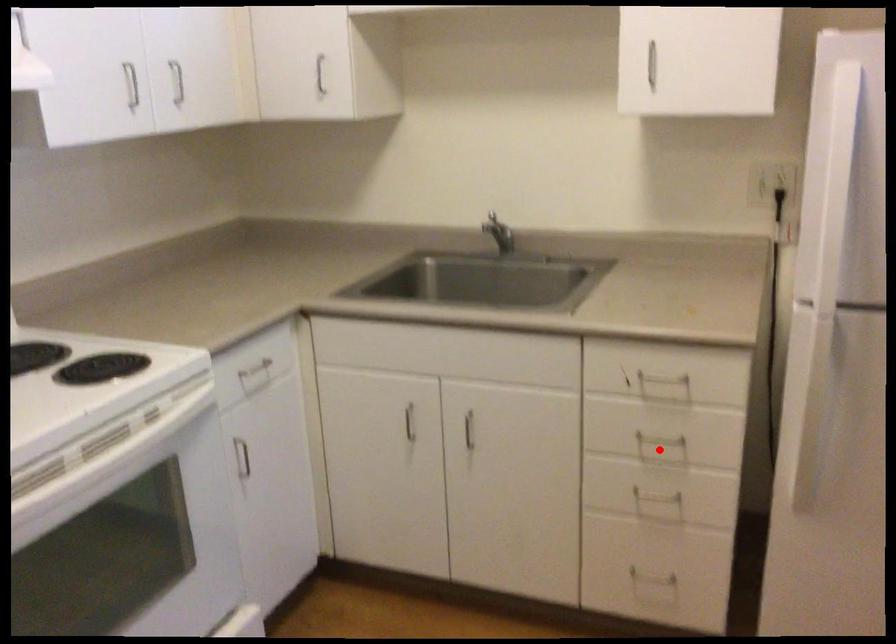
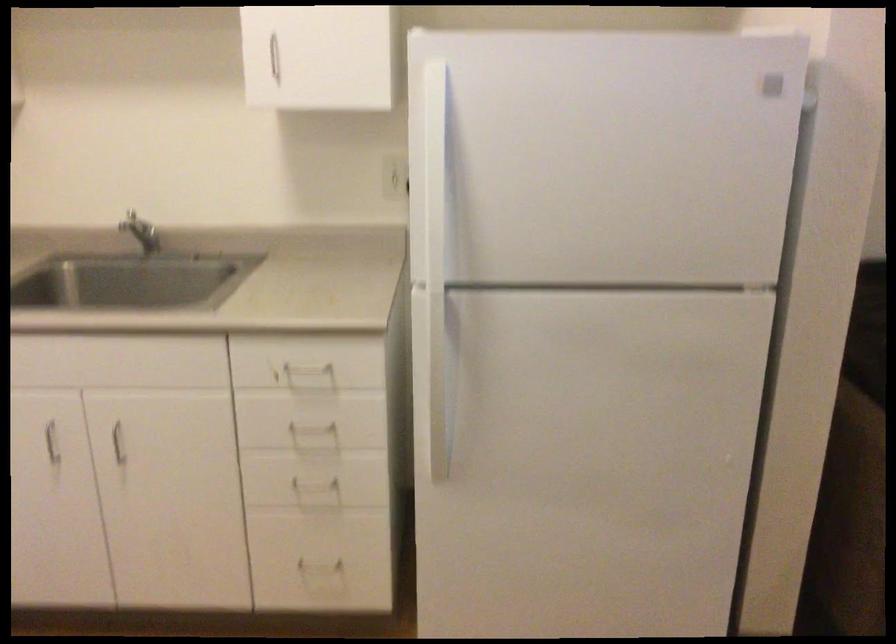
Question: I am providing you with two images of the same scene from different viewpoints. A red point is marked on the first image. Is the red point's position out of view in image 2?

Choices:
 (A) Yes
 (B) No

Answer: (B)